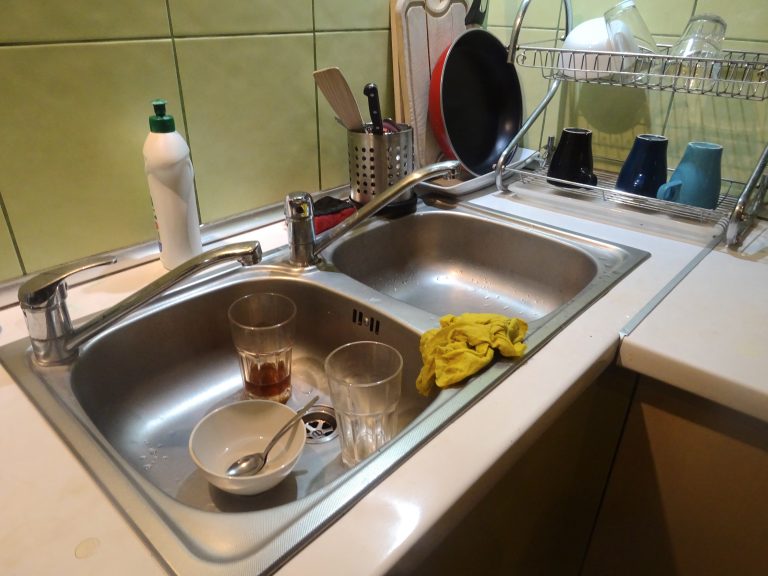
The height and width of the screenshot is (576, 768). In order to click on cutting board in this screenshot , I will do `click(415, 41)`.